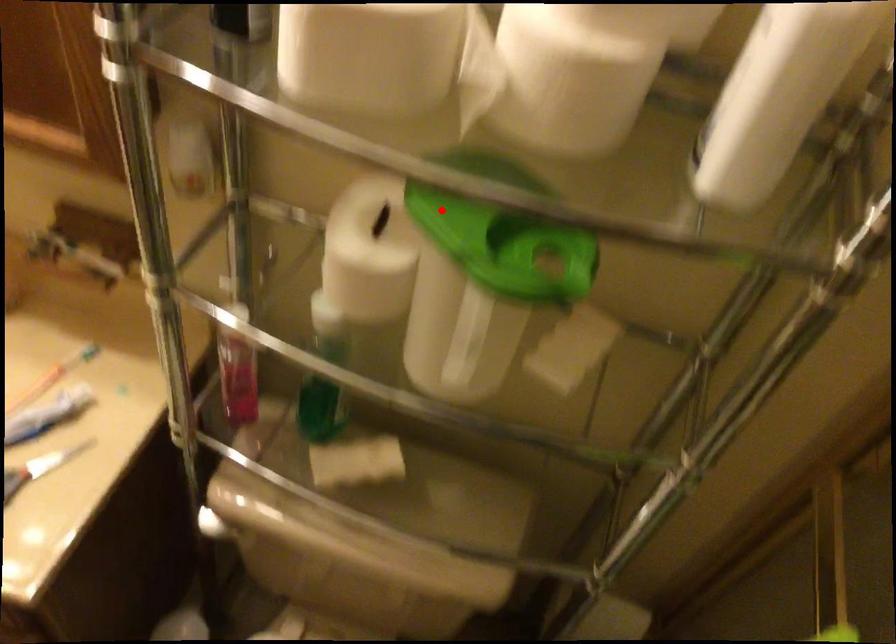
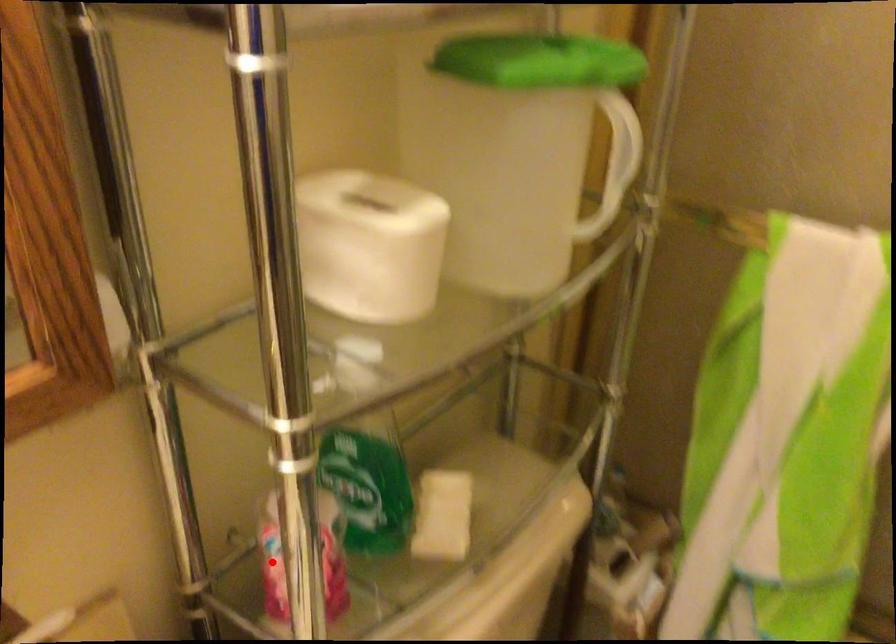
I am providing you with two images of the same scene from different viewpoints. A red point is marked on the first image and another point is marked on the second image. Is the red point in image1 aligned with the point shown in image2?

No